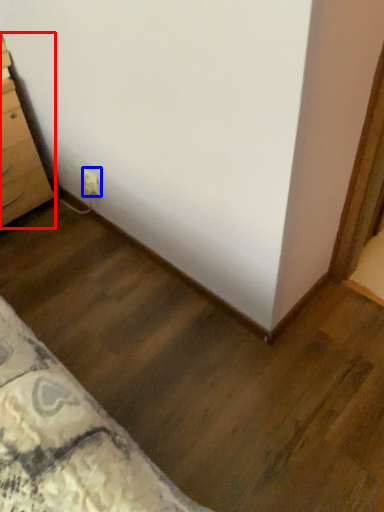
Question: Which of the following is the closest to the observer, chest of drawers (highlighted by a red box) or electric outlet (highlighted by a blue box)?

Choices:
 (A) chest of drawers
 (B) electric outlet

Answer: (A)